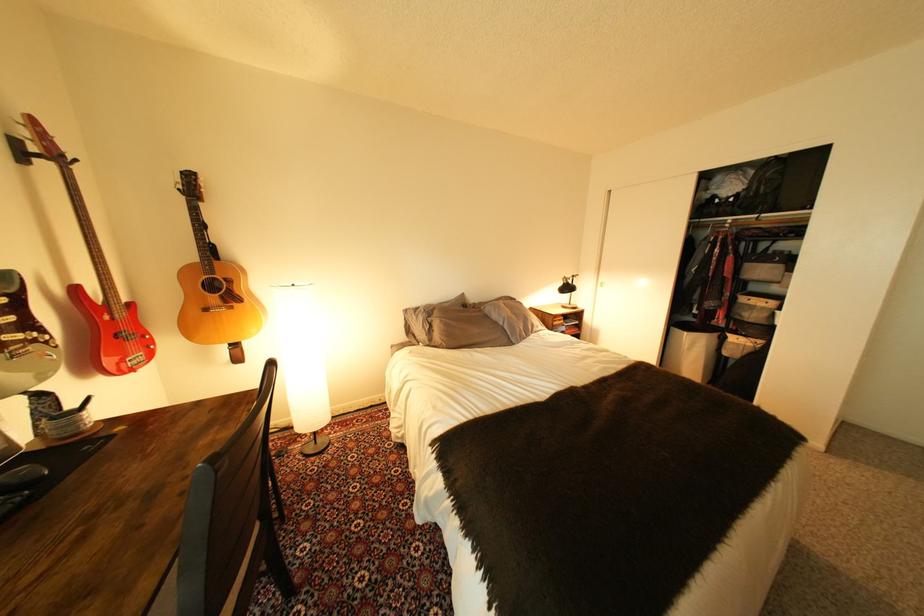
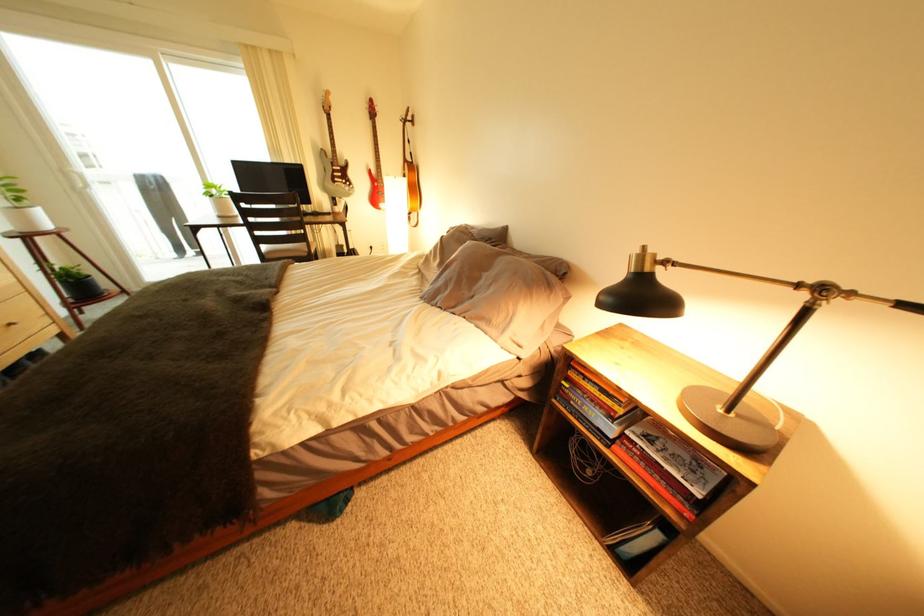
Where in the second image is the point corresponding to (26,350) from the first image?

(349, 185)